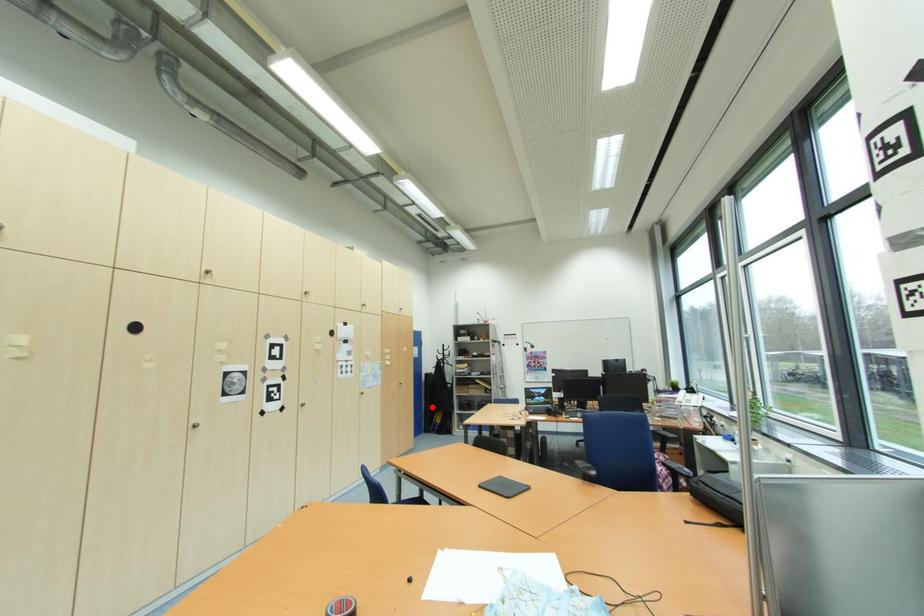
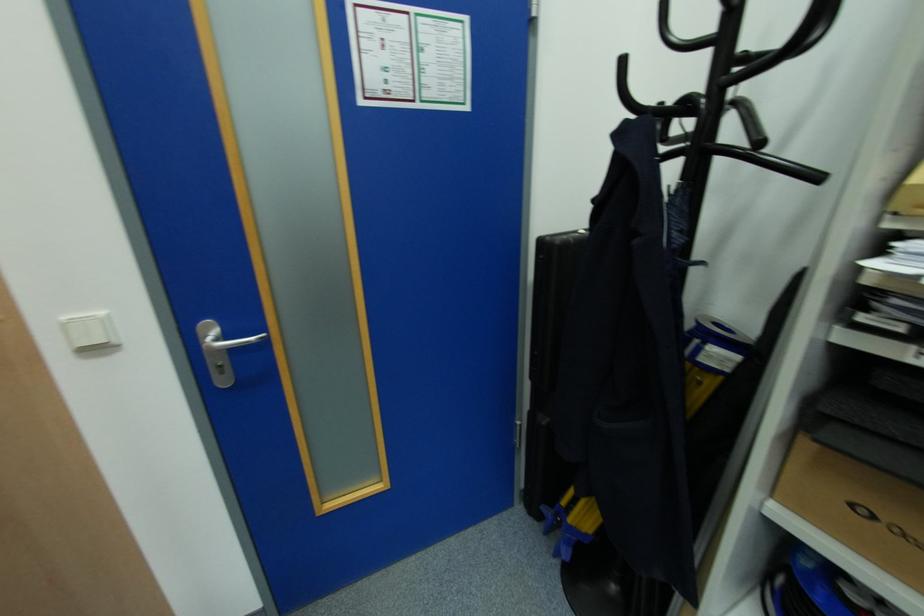
Question: I am providing you with two images of the same scene from different viewpoints. Given a red point in image1, look at the same physical point in image2. Is it:

Choices:
 (A) Closer to the viewpoint
 (B) Farther from the viewpoint

Answer: (A)